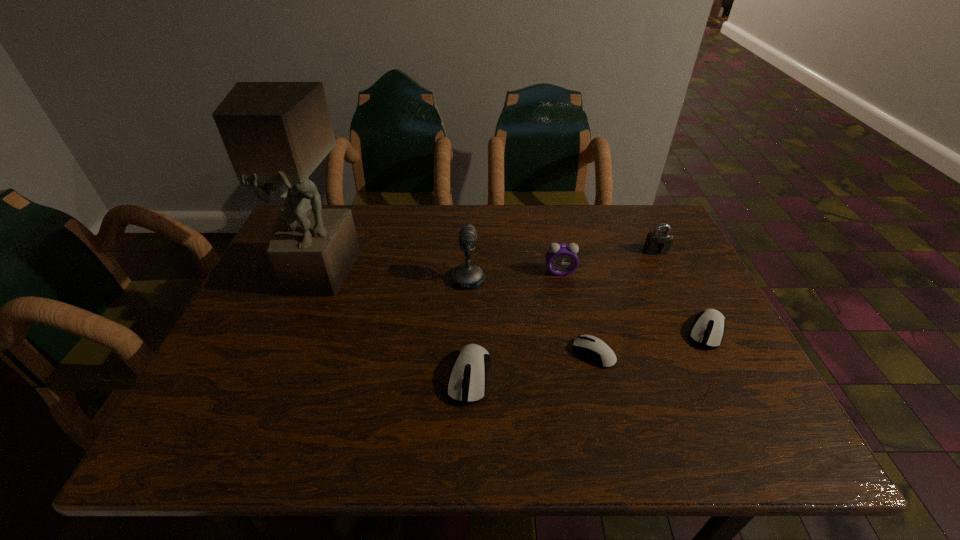
The width and height of the screenshot is (960, 540). Identify the location of object positioned at the near edge. (467, 381).

Find the location of a particular element. The image size is (960, 540). object at the left edge is located at coordinates (275, 133).

The width and height of the screenshot is (960, 540). Find the location of `mouse that is at the right edge`. mouse that is at the right edge is located at coordinates (708, 329).

Where is `padlock at the right edge`? padlock at the right edge is located at coordinates (658, 242).

The height and width of the screenshot is (540, 960). I want to click on object located in the far left corner section of the desktop, so click(275, 133).

This screenshot has height=540, width=960. What are the coordinates of `object present at the far right corner` in the screenshot? It's located at (658, 242).

Locate an element on the screen. The image size is (960, 540). vacant area at the far edge of the desktop is located at coordinates (589, 215).

Find the location of a particular element. The height and width of the screenshot is (540, 960). free location at the near edge of the desktop is located at coordinates (306, 393).

Where is `vacant space at the right edge`? Image resolution: width=960 pixels, height=540 pixels. vacant space at the right edge is located at coordinates (657, 300).

Locate an element on the screen. vacant space at the far left corner of the desktop is located at coordinates (326, 205).